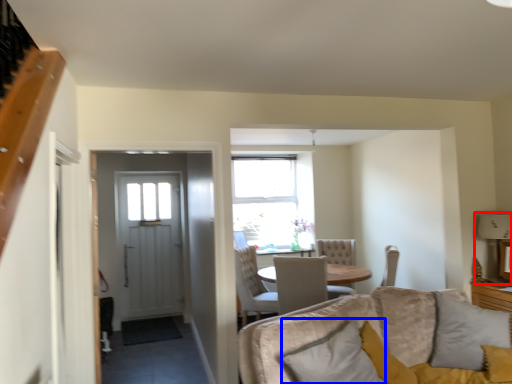
Question: Among these objects, which one is nearest to the camera, lamp (highlighted by a red box) or pillow (highlighted by a blue box)?

Choices:
 (A) lamp
 (B) pillow

Answer: (B)